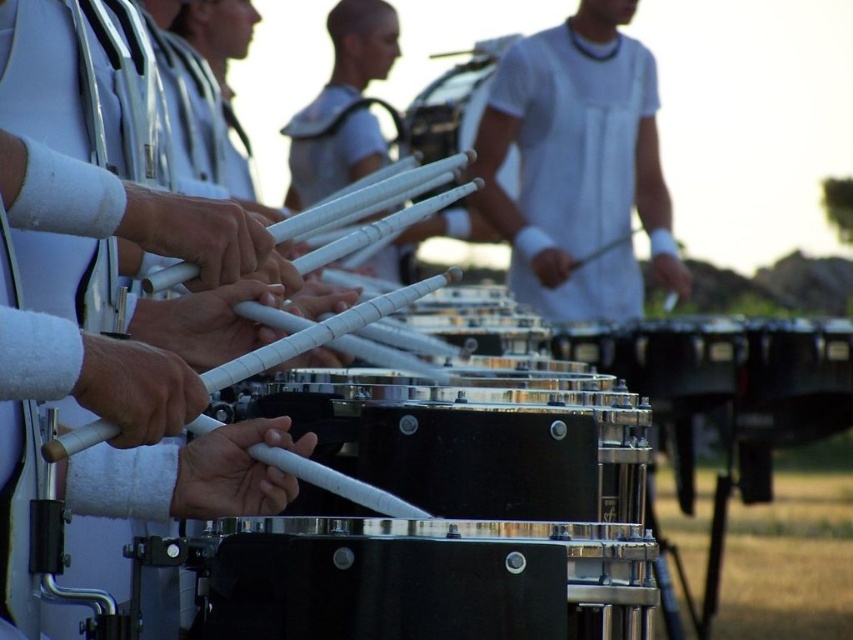
Question: Is white matte shirt at center bigger than black metallic drum at center?

Choices:
 (A) yes
 (B) no

Answer: (A)

Question: Can you confirm if white matte shirt at center is bigger than black metallic drum at center?

Choices:
 (A) no
 (B) yes

Answer: (B)

Question: Is the position of white matte shirt at center more distant than that of black metallic drum at center?

Choices:
 (A) yes
 (B) no

Answer: (A)

Question: Which object is the farthest from the black polished drum at center?

Choices:
 (A) black metallic drum at center
 (B) white matte shirt at center

Answer: (A)

Question: Which point is farther to the camera?

Choices:
 (A) (579, 449)
 (B) (445, 106)
 (C) (515, 253)

Answer: (C)

Question: Which object is positioned farthest from the white matte shirt at center?

Choices:
 (A) black metallic drum at center
 (B) black polished drum at center

Answer: (A)